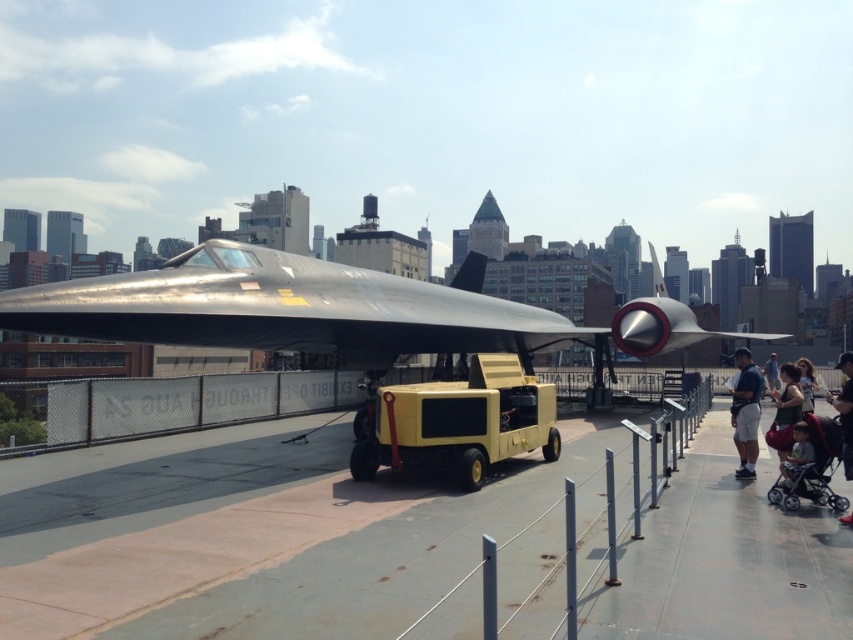
You are a visitor standing at the edge of the platform where the aircraft is displayed. You notice the yellow rubber tarmac at center and the dark blue jeans at center. Which object is closer to you?

The yellow rubber tarmac at center is closer to you because it is in front of the dark blue jeans at center.

You are standing at the point marked by the coordinates point (746,412) in the image. Which object is directly in front of you?

The dark blue jeans at center is represented by point (746,412), so the object directly in front of you is the dark blue jeans at center.

You are a visitor at an outdoor exhibition and want to take a photo of the shiny metallic airplane at center without any obstructions. However, there is a matte black stroller at lower right in the way. Based on their positions, can you move the stroller to the side so that the airplane remains visible in your photo?

The shiny metallic airplane at center is located above the matte black stroller at lower right, so moving the stroller to the side would allow the airplane to remain visible in the photo since it is positioned higher and not directly blocking the view.